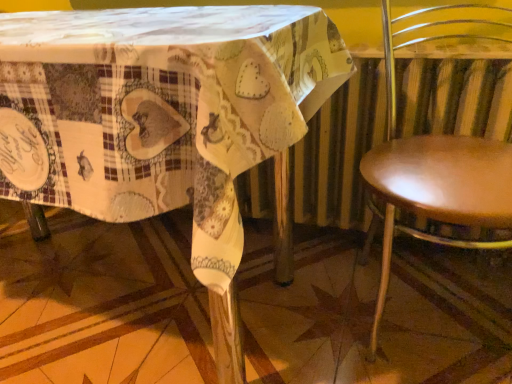
Image resolution: width=512 pixels, height=384 pixels. I want to click on vacant space situated on the left part of shiny brown seat at right, so click(278, 310).